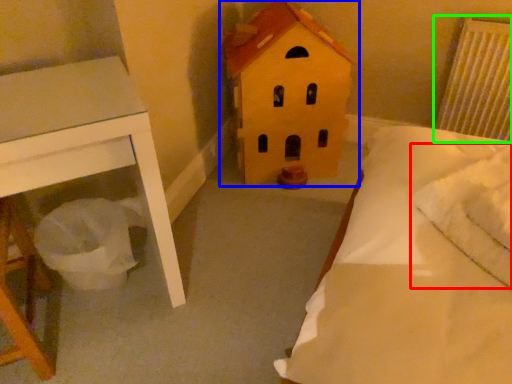
Question: Estimate the real-world distances between objects in this image. Which object is closer to pillow (highlighted by a red box), toy (highlighted by a blue box) or radiator (highlighted by a green box)?

Choices:
 (A) toy
 (B) radiator

Answer: (A)